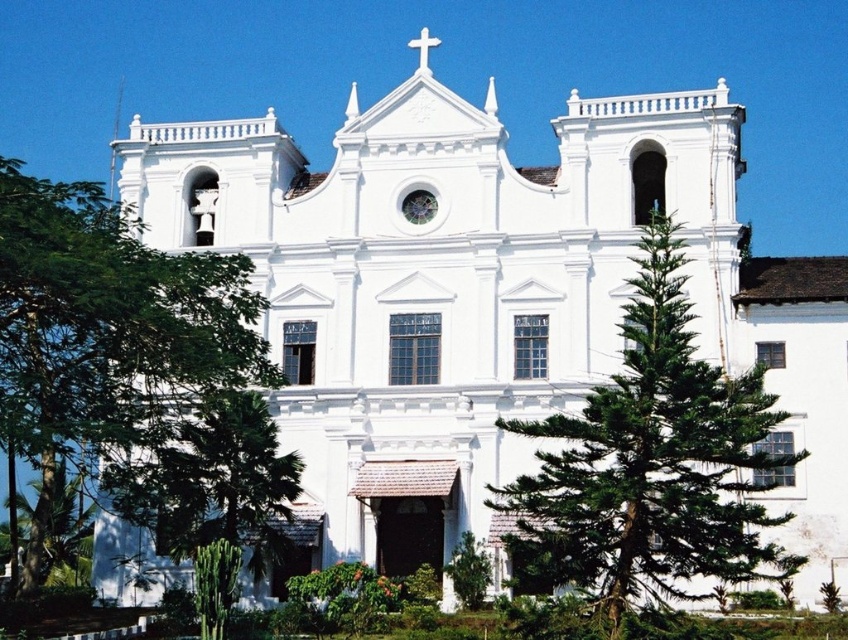
Is point (38, 460) behind point (737, 429)?

Yes.

Is point (37, 440) more distant than point (646, 406)?

Yes, it is behind point (646, 406).

This screenshot has height=640, width=848. In order to click on green leafy tree at left in this screenshot , I will do `click(132, 371)`.

Is green leafy tree at left behind green leafy tree at lower left?

No, it is not.

Is point (31, 410) farther from camera compared to point (140, 520)?

That is False.

Who is more forward, (116, 262) or (261, 497)?

Positioned in front is point (116, 262).

Where is `green leafy tree at left`? green leafy tree at left is located at coordinates (132, 371).

Does green leafy tree at right come behind green leafy tree at lower left?

No, green leafy tree at right is closer to the viewer.

Is green leafy tree at right taller than green leafy tree at lower left?

Indeed, green leafy tree at right has a greater height compared to green leafy tree at lower left.

Is point (642, 396) positioned in front of point (177, 422)?

Yes.

Where is `green leafy tree at right`? green leafy tree at right is located at coordinates (648, 465).